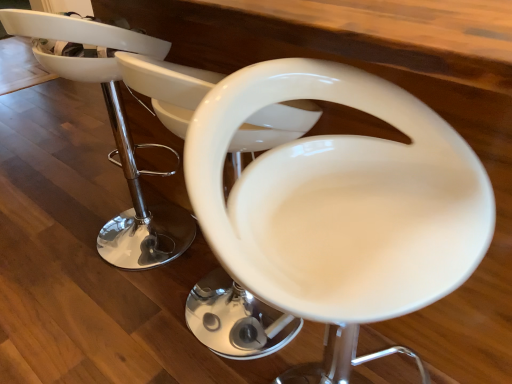
Question: Is white glossy bar stool at center, marked as the 1th feeding chair in a front-to-back arrangement, in front of or behind white glossy bar stool at center, which is the 2th feeding chair from front to back, in the image?

Choices:
 (A) front
 (B) behind

Answer: (A)

Question: Visually, is white glossy bar stool at center, marked as the 1th feeding chair in a front-to-back arrangement, positioned to the left or to the right of white glossy bar stool at center, which is the 1th feeding chair from back to front?

Choices:
 (A) left
 (B) right

Answer: (B)

Question: Which is nearer to the white glossy bar stool at center, which is the 2th feeding chair from front to back?

Choices:
 (A) white glossy bar stool at center, marked as the 1th feeding chair in a front-to-back arrangement
 (B) white glossy bar stool at center

Answer: (A)

Question: Estimate the real-world distances between objects in this image. Which object is farther from the white glossy bar stool at center, marked as the 1th feeding chair in a front-to-back arrangement?

Choices:
 (A) white glossy bar stool at center
 (B) white glossy bar stool at center, which is the 2th feeding chair from front to back

Answer: (A)